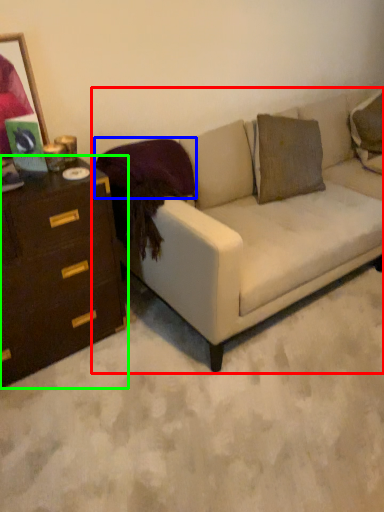
Question: Which object is the closest to the studio couch (highlighted by a red box)? Choose among these: pillow (highlighted by a blue box) or chest of drawers (highlighted by a green box).

Choices:
 (A) pillow
 (B) chest of drawers

Answer: (A)